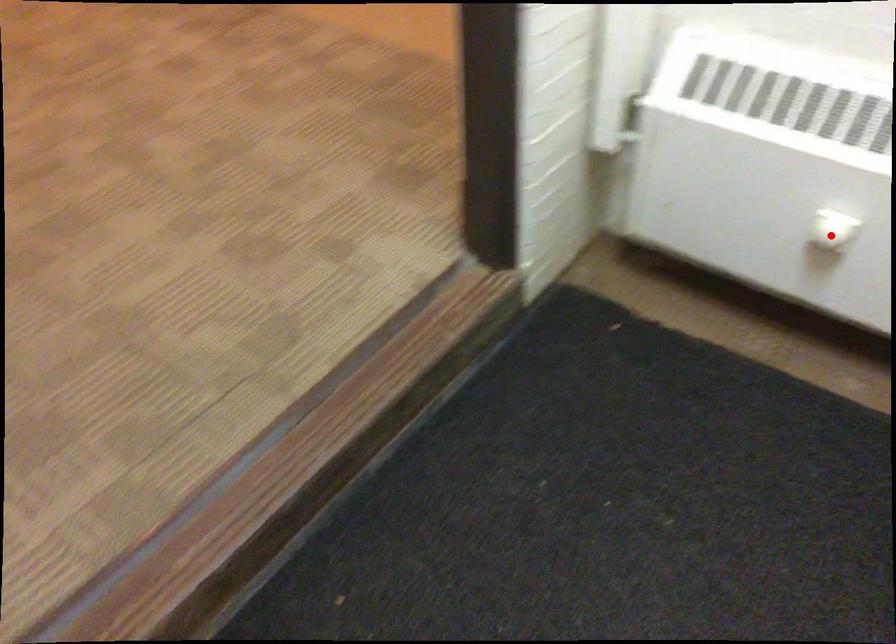
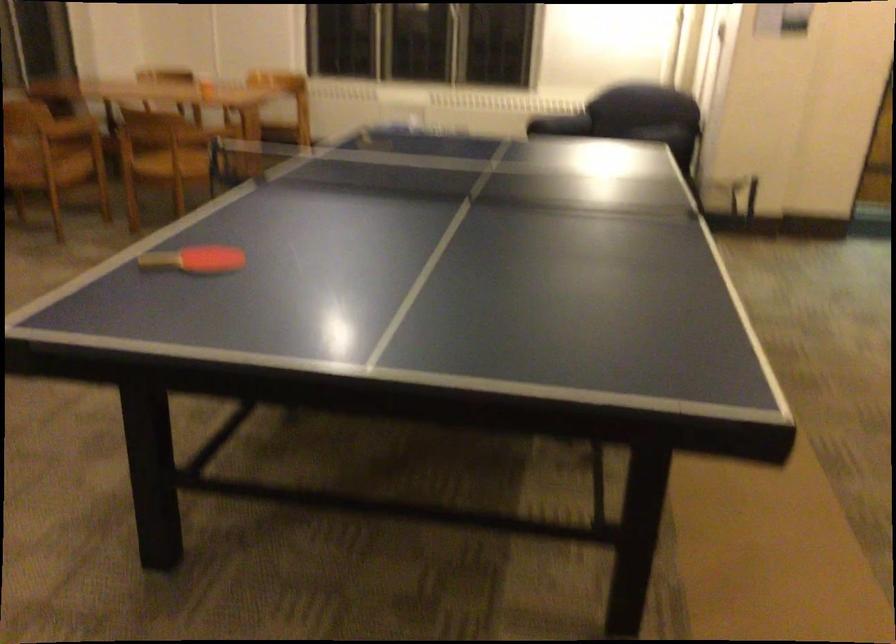
Question: I am providing you with two images of the same scene from different viewpoints. A red point is marked on the first image. Is the red point's position out of view in image 2?

Choices:
 (A) Yes
 (B) No

Answer: (A)